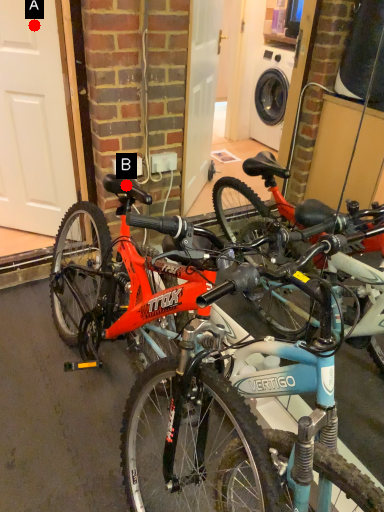
Question: Two points are circled on the image, labeled by A and B beside each circle. Which point is farther from the camera taking this photo?

Choices:
 (A) A is further
 (B) B is further

Answer: (A)